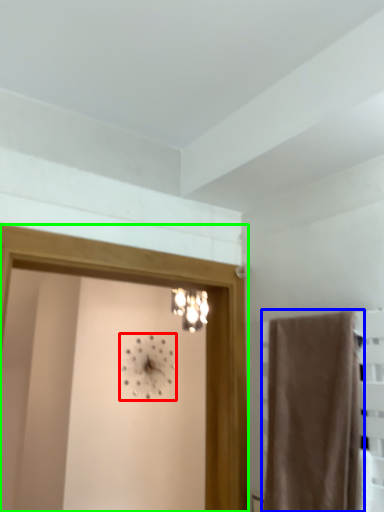
Question: Which object is the farthest from clock (highlighted by a red box)? Choose among these: curtain (highlighted by a blue box) or screen door (highlighted by a green box).

Choices:
 (A) curtain
 (B) screen door

Answer: (A)